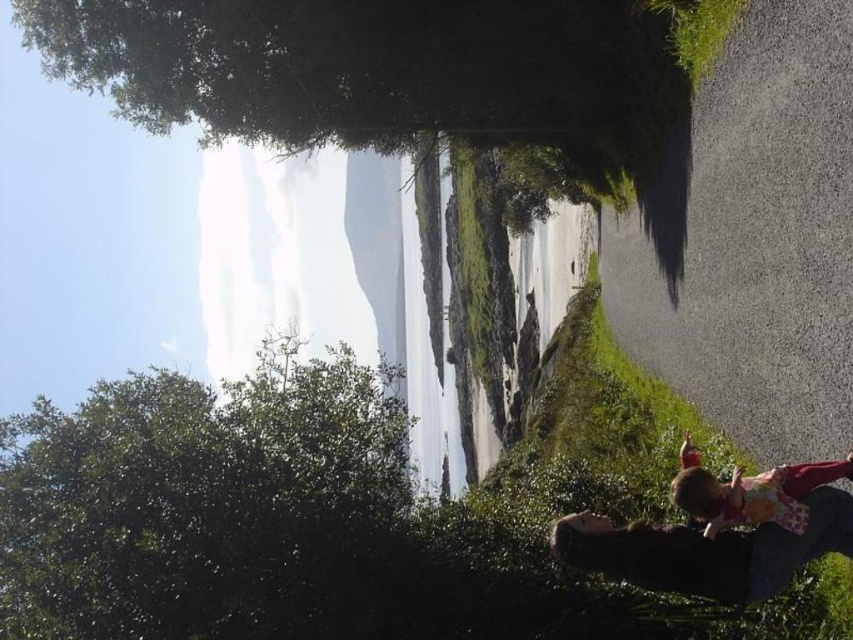
You are a photographer trying to capture a photo of the floral dress at lower right without the green leafy tree at upper left blocking the view. Is it possible to do so given their sizes?

The green leafy tree at upper left is taller than the floral dress at lower right, so it may block the view depending on the angle. However, since the tree is at the upper left and the dress is at the lower right, adjusting the camera angle downward or moving to a position where the tree is out of frame could allow capturing the dress without obstruction.

You are standing at the center of the paved road in the foreground and want to take a photo of the green leafy tree at upper left. Which direction should you turn to face the tree?

The green leafy tree at upper left is located at point (207, 506), which means it is positioned to the upper left from your current position at the center of the road. You should turn to your upper left to face the tree.